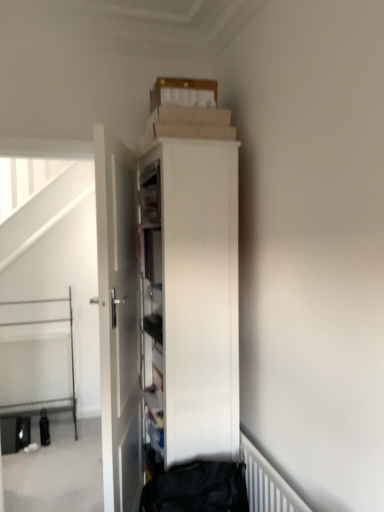
The image size is (384, 512). Find the location of `white glossy door at center`. white glossy door at center is located at coordinates (119, 321).

Describe the element at coordinates (191, 293) in the screenshot. The height and width of the screenshot is (512, 384). I see `white glossy cabinet at center` at that location.

Image resolution: width=384 pixels, height=512 pixels. What are the coordinates of `white metal bed at lower left` in the screenshot? It's located at (37, 364).

Is white matte radiator at lower right, acting as the 2th radiator starting from the back, not close to white metal bed at lower left?

Absolutely, white matte radiator at lower right, acting as the 2th radiator starting from the back, is distant from white metal bed at lower left.

Based on the photo, is white matte radiator at lower right, which ranks as the second radiator in left-to-right order, surrounding white metal bed at lower left?

No, white metal bed at lower left is located outside of white matte radiator at lower right, which ranks as the second radiator in left-to-right order.

From a real-world perspective, relative to white metal bed at lower left, is white matte radiator at lower right, the 1th radiator from the front, vertically above or below?

Clearly, from a real-world perspective, white matte radiator at lower right, the 1th radiator from the front, is below white metal bed at lower left.

Considering the points (267, 484) and (59, 326), which point is in front, point (267, 484) or point (59, 326)?

Positioned in front is point (267, 484).

Between white glossy door at center and white textured radiator at lower left, placed as the second radiator when sorted from right to left, which one has smaller size?

white textured radiator at lower left, placed as the second radiator when sorted from right to left.

Does white glossy door at center appear on the left side of white textured radiator at lower left, placed as the second radiator when sorted from right to left?

Incorrect, white glossy door at center is not on the left side of white textured radiator at lower left, placed as the second radiator when sorted from right to left.

Identify the location of door above the white textured radiator at lower left, acting as the 2th radiator starting from the front (from a real-world perspective). This screenshot has width=384, height=512. (119, 321).

Is white glossy door at center in contact with white textured radiator at lower left, acting as the 2th radiator starting from the front?

No, white glossy door at center is not touching white textured radiator at lower left, acting as the 2th radiator starting from the front.

Considering the relative sizes of white matte radiator at lower right, which ranks as the second radiator in left-to-right order, and white textured radiator at lower left, acting as the 2th radiator starting from the front, in the image provided, is white matte radiator at lower right, which ranks as the second radiator in left-to-right order, bigger than white textured radiator at lower left, acting as the 2th radiator starting from the front,?

No, white matte radiator at lower right, which ranks as the second radiator in left-to-right order, is not bigger than white textured radiator at lower left, acting as the 2th radiator starting from the front.

From a real-world perspective, which object rests below the other?

white textured radiator at lower left, acting as the 2th radiator starting from the front.

Does white matte radiator at lower right, acting as the 2th radiator starting from the back, have a greater width compared to white textured radiator at lower left, acting as the first radiator starting from the left?

Incorrect, the width of white matte radiator at lower right, acting as the 2th radiator starting from the back, does not surpass that of white textured radiator at lower left, acting as the first radiator starting from the left.

Is white matte radiator at lower right, which ranks as the second radiator in left-to-right order, touching white textured radiator at lower left, which appears as the first radiator when viewed from the back?

No.

Looking at this image, between white metal bed at lower left and white textured radiator at lower left, placed as the second radiator when sorted from right to left, which one appears on the right side from the viewer's perspective?

From the viewer's perspective, white metal bed at lower left appears more on the right side.

From a real-world perspective, is white metal bed at lower left above or below white textured radiator at lower left, acting as the first radiator starting from the left?

In terms of real-world spatial position, white metal bed at lower left is above white textured radiator at lower left, acting as the first radiator starting from the left.

Which is correct: white metal bed at lower left is inside white textured radiator at lower left, placed as the second radiator when sorted from right to left, or outside of it?

The correct answer is: outside.

Is white metal bed at lower left with white textured radiator at lower left, acting as the first radiator starting from the left?

Yes, white metal bed at lower left is with white textured radiator at lower left, acting as the first radiator starting from the left.

Is white textured radiator at lower left, acting as the first radiator starting from the left, taller or shorter than white metal bed at lower left?

In the image, white textured radiator at lower left, acting as the first radiator starting from the left, appears to be shorter than white metal bed at lower left.

Considering the sizes of objects white textured radiator at lower left, acting as the first radiator starting from the left, and white metal bed at lower left in the image provided, who is wider, white textured radiator at lower left, acting as the first radiator starting from the left, or white metal bed at lower left?

With larger width is white metal bed at lower left.

Who is bigger, white textured radiator at lower left, placed as the second radiator when sorted from right to left, or white metal bed at lower left?

white metal bed at lower left.

From a real-world perspective, is white textured radiator at lower left, placed as the second radiator when sorted from right to left, physically below white metal bed at lower left?

Yes, from a real-world perspective, white textured radiator at lower left, placed as the second radiator when sorted from right to left, is below white metal bed at lower left.

Is white glossy cabinet at center next to white matte radiator at lower right, which is the 1th radiator from right to left?

No, white glossy cabinet at center is not making contact with white matte radiator at lower right, which is the 1th radiator from right to left.

Is white glossy cabinet at center oriented towards white matte radiator at lower right, acting as the 2th radiator starting from the back?

No, white glossy cabinet at center is not oriented towards white matte radiator at lower right, acting as the 2th radiator starting from the back.

How much distance is there between white glossy cabinet at center and white matte radiator at lower right, which ranks as the second radiator in left-to-right order?

white glossy cabinet at center and white matte radiator at lower right, which ranks as the second radiator in left-to-right order, are 19.25 inches apart from each other.

Between white glossy cabinet at center and white matte radiator at lower right, the 1th radiator from the front, which one has larger size?

With larger size is white glossy cabinet at center.

From a real-world perspective, is white matte radiator at lower right, which is the 1th radiator from right to left, on top of white glossy cabinet at center?

No, from a real-world perspective, white matte radiator at lower right, which is the 1th radiator from right to left, is not on top of white glossy cabinet at center.

In the scene shown: Is white matte radiator at lower right, which ranks as the second radiator in left-to-right order, next to white glossy cabinet at center?

They are not placed beside each other.

Between white matte radiator at lower right, which ranks as the second radiator in left-to-right order, and white glossy cabinet at center, which one has smaller width?

white matte radiator at lower right, which ranks as the second radiator in left-to-right order, is thinner.

From the image's perspective, which radiator is the 1st one below the white glossy cabinet at center? Please provide its 2D coordinates.

[(267, 483)]

Locate an element on the screen. This screenshot has height=512, width=384. bed on the left side of white matte radiator at lower right, the 1th radiator from the front is located at coordinates (37, 364).

I want to click on door above the white textured radiator at lower left, placed as the second radiator when sorted from right to left (from a real-world perspective), so click(119, 321).

Estimate the real-world distances between objects in this image. Which object is further from white matte radiator at lower right, which ranks as the second radiator in left-to-right order, white glossy door at center or white textured radiator at lower left, placed as the second radiator when sorted from right to left?

Based on the image, white textured radiator at lower left, placed as the second radiator when sorted from right to left, appears to be further to white matte radiator at lower right, which ranks as the second radiator in left-to-right order.

When comparing their distances from white glossy cabinet at center, does white glossy door at center or white matte radiator at lower right, acting as the 2th radiator starting from the back, seem closer?

Among the two, white glossy door at center is located nearer to white glossy cabinet at center.

When comparing their distances from white glossy door at center, does white textured radiator at lower left, acting as the 2th radiator starting from the front, or white metal bed at lower left seem further?

white textured radiator at lower left, acting as the 2th radiator starting from the front, is further to white glossy door at center.

Consider the image. Based on their spatial positions, is white matte radiator at lower right, the 1th radiator from the front, or white glossy door at center further from white textured radiator at lower left, acting as the first radiator starting from the left?

Among the two, white matte radiator at lower right, the 1th radiator from the front, is located further to white textured radiator at lower left, acting as the first radiator starting from the left.

When comparing their distances from white matte radiator at lower right, which is the 1th radiator from right to left, does white glossy cabinet at center or white metal bed at lower left seem closer?

white glossy cabinet at center lies closer to white matte radiator at lower right, which is the 1th radiator from right to left, than the other object.

In the scene shown: Estimate the real-world distances between objects in this image. Which object is closer to white metal bed at lower left, white glossy cabinet at center or white matte radiator at lower right, which is the 1th radiator from right to left?

white glossy cabinet at center is closer to white metal bed at lower left.

Based on their spatial positions, is white textured radiator at lower left, which appears as the first radiator when viewed from the back, or white metal bed at lower left closer to white matte radiator at lower right, which ranks as the second radiator in left-to-right order?

The object closer to white matte radiator at lower right, which ranks as the second radiator in left-to-right order, is white metal bed at lower left.

Which object lies further to the anchor point white glossy door at center, white metal bed at lower left or white glossy cabinet at center?

The object further to white glossy door at center is white metal bed at lower left.

Find the location of a particular element. bed positioned between white matte radiator at lower right, the 1th radiator from the front, and white textured radiator at lower left, placed as the second radiator when sorted from right to left, from near to far is located at coordinates (37, 364).

Find the location of a particular element. door between white glossy cabinet at center and white matte radiator at lower right, acting as the 2th radiator starting from the back, in the vertical direction is located at coordinates (119, 321).

This screenshot has width=384, height=512. In order to click on bed positioned between white glossy cabinet at center and white textured radiator at lower left, acting as the first radiator starting from the left, from near to far in this screenshot , I will do `click(37, 364)`.

Image resolution: width=384 pixels, height=512 pixels. I want to click on bed between white glossy door at center and white textured radiator at lower left, placed as the second radiator when sorted from right to left, from front to back, so click(x=37, y=364).